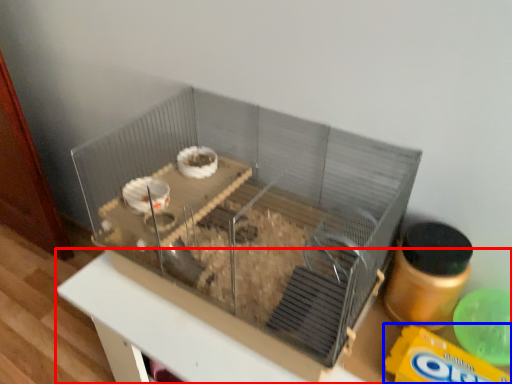
Question: Which of the following is the farthest to the observer, table (highlighted by a red box) or cereal (highlighted by a blue box)?

Choices:
 (A) table
 (B) cereal

Answer: (B)